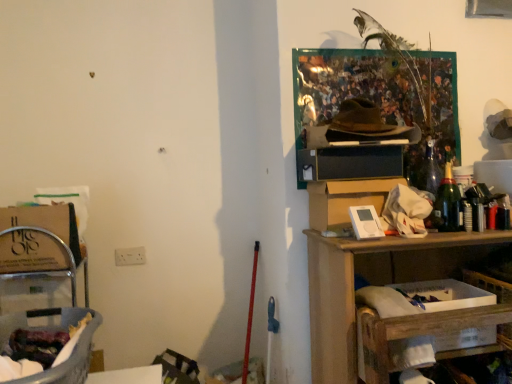
Question: Is white cardboard box at lower right not within white cardboard box at upper right, positioned as the first cardboard box in right-to-left order?

Choices:
 (A) yes
 (B) no

Answer: (A)

Question: From the image's perspective, is white cardboard box at lower right above white cardboard box at upper right, which is counted as the second cardboard box, starting from the left?

Choices:
 (A) yes
 (B) no

Answer: (B)

Question: Is white cardboard box at lower right to the left of white cardboard box at upper right, which is counted as the second cardboard box, starting from the left, from the viewer's perspective?

Choices:
 (A) no
 (B) yes

Answer: (A)

Question: Does white cardboard box at lower right have a larger size compared to white cardboard box at upper right, which is counted as the second cardboard box, starting from the left?

Choices:
 (A) no
 (B) yes

Answer: (B)

Question: Is white cardboard box at lower right further to camera compared to white cardboard box at upper right, positioned as the first cardboard box in right-to-left order?

Choices:
 (A) yes
 (B) no

Answer: (B)

Question: Is white cardboard box at lower right next to white cardboard box at upper right, which is counted as the second cardboard box, starting from the left?

Choices:
 (A) no
 (B) yes

Answer: (A)

Question: Is translucent plastic laundry basket at lower left at the back of green glass bottle at right?

Choices:
 (A) yes
 (B) no

Answer: (B)

Question: Does green glass bottle at right appear on the left side of translucent plastic laundry basket at lower left?

Choices:
 (A) yes
 (B) no

Answer: (B)

Question: Can you confirm if green glass bottle at right is smaller than translucent plastic laundry basket at lower left?

Choices:
 (A) no
 (B) yes

Answer: (B)

Question: Could translucent plastic laundry basket at lower left be considered to be inside green glass bottle at right?

Choices:
 (A) yes
 (B) no

Answer: (B)

Question: From a real-world perspective, is green glass bottle at right physically above translucent plastic laundry basket at lower left?

Choices:
 (A) no
 (B) yes

Answer: (B)

Question: Is green glass bottle at right positioned before translucent plastic laundry basket at lower left?

Choices:
 (A) no
 (B) yes

Answer: (A)

Question: Does white cardboard box at upper right, which is counted as the second cardboard box, starting from the left, have a larger size compared to wooden shelf at right?

Choices:
 (A) yes
 (B) no

Answer: (B)